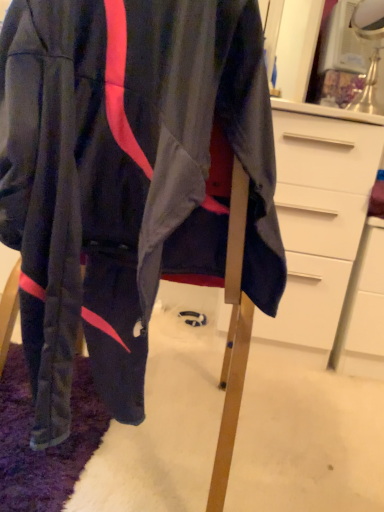
Describe the element at coordinates (127, 177) in the screenshot. I see `navy blue fabric jacket at center` at that location.

In order to face navy blue fabric jacket at center, should I rotate leftwards or rightwards?

Turn left approximately 6.015 degrees to face it.

The height and width of the screenshot is (512, 384). What are the coordinates of `navy blue fabric jacket at center` in the screenshot? It's located at (127, 177).

The width and height of the screenshot is (384, 512). In order to click on navy blue fabric jacket at center in this screenshot , I will do `click(127, 177)`.